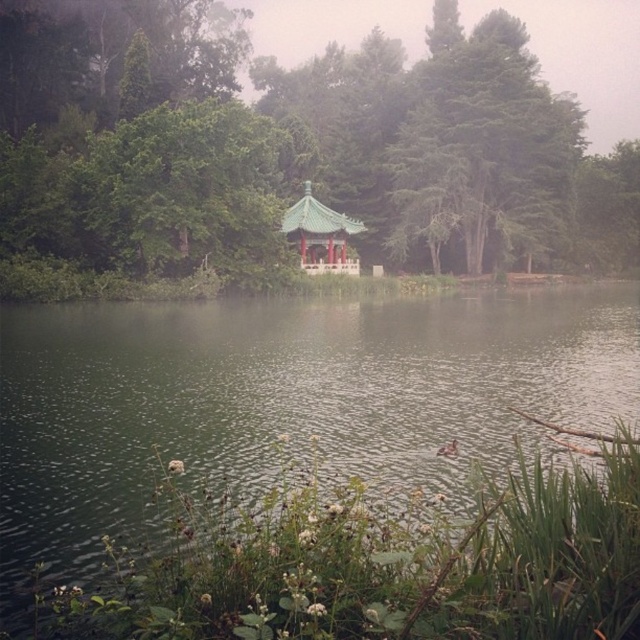
Measure the distance between green leafy tree at center and green glazed pagoda at center.

The distance of green leafy tree at center from green glazed pagoda at center is 13.81 meters.

You are a GUI agent. You are given a task and a screenshot of the screen. Output one action in this format:
    pyautogui.click(x=<x>, y=<y>)
    Task: Click on the green leafy tree at center
    The height and width of the screenshot is (640, 640).
    Given the screenshot: What is the action you would take?
    pos(294,145)

From the picture: Is the position of green leafy tree at center more distant than that of green textured tree at upper center?

No, green leafy tree at center is closer to the viewer.

Who is more distant from viewer, (10, 234) or (474, 35)?

Positioned behind is point (474, 35).

Find the location of a particular element. This screenshot has height=640, width=640. green leafy tree at center is located at coordinates pyautogui.click(x=294, y=145).

Consider the image. Who is lower down, green textured tree at upper center or green glazed pagoda at center?

green glazed pagoda at center is below.

Based on the photo, can you confirm if green textured tree at upper center is wider than green glazed pagoda at center?

Yes, green textured tree at upper center is wider than green glazed pagoda at center.

The image size is (640, 640). Find the location of `green textured tree at upper center`. green textured tree at upper center is located at coordinates (483, 147).

Identify the location of green textured tree at upper center. This screenshot has height=640, width=640. (483, 147).